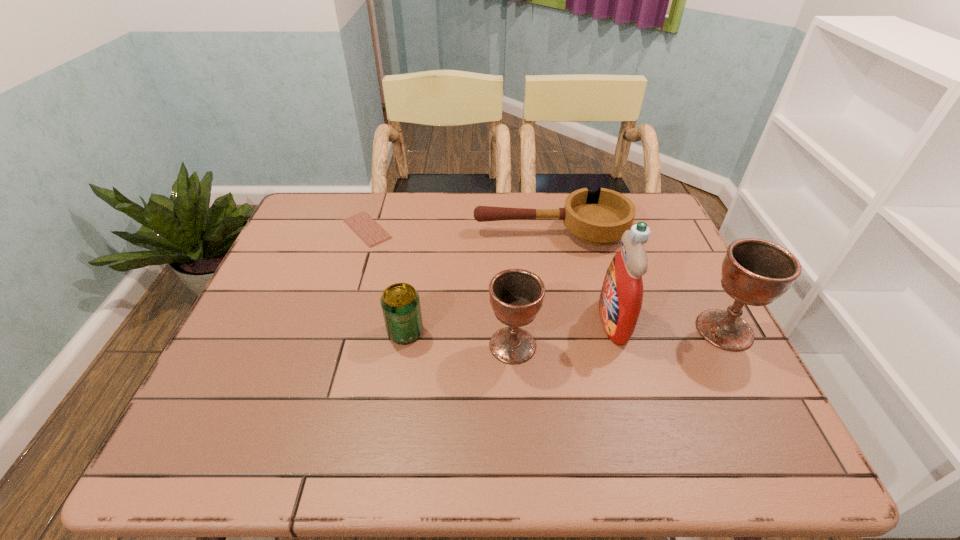
I want to click on blank space located 0.200m on the back of the third tallest object, so click(508, 271).

Image resolution: width=960 pixels, height=540 pixels. I want to click on vacant space situated 0.130m on the left of the rightmost object, so click(x=640, y=330).

Identify the location of vacant position located with the handle on the side of the fifth tallest object. This screenshot has height=540, width=960. (384, 232).

Image resolution: width=960 pixels, height=540 pixels. Identify the location of vacant area situated 0.150m with the handle on the side of the fifth tallest object. (424, 232).

Image resolution: width=960 pixels, height=540 pixels. I want to click on free space located 0.230m with the handle on the side of the fifth tallest object, so coord(397,232).

Image resolution: width=960 pixels, height=540 pixels. In order to click on vacant space located 0.100m on the front surface of the detergent in this screenshot , I will do `click(557, 321)`.

I want to click on free space located 0.250m on the front surface of the detergent, so click(x=495, y=321).

Image resolution: width=960 pixels, height=540 pixels. What are the coordinates of `vacant space situated on the front surface of the detergent` in the screenshot? It's located at (553, 321).

Where is `free region located 0.100m on the left of the chocolate bar`? The image size is (960, 540). free region located 0.100m on the left of the chocolate bar is located at coordinates (307, 229).

Image resolution: width=960 pixels, height=540 pixels. Identify the location of vacant space located on the left of the third shortest object. (291, 332).